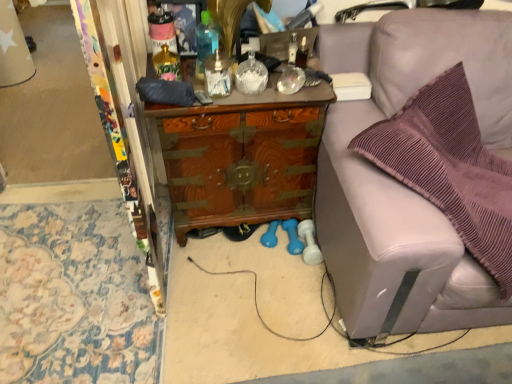
Question: Which direction should I rotate to face clear glass jar at center, which appears as the 1th bottle when viewed from the right, — up or down?

Choices:
 (A) up
 (B) down

Answer: (A)

Question: Which direction should I rotate to face translucent blue bottle at center, the third bottle when ordered from left to right, — up or down?

Choices:
 (A) down
 (B) up

Answer: (B)

Question: From the image's perspective, is purple fabric chair at right under translucent glass vase at center, placed as the 4th bottle when sorted from right to left?

Choices:
 (A) no
 (B) yes

Answer: (B)

Question: From the image's perspective, is purple fabric chair at right on top of translucent glass vase at center, the second bottle from the left?

Choices:
 (A) yes
 (B) no

Answer: (B)

Question: Would you say purple fabric chair at right is outside translucent glass vase at center, the second bottle from the left?

Choices:
 (A) no
 (B) yes

Answer: (B)

Question: Can you confirm if purple fabric chair at right is taller than translucent glass vase at center, placed as the 4th bottle when sorted from right to left?

Choices:
 (A) yes
 (B) no

Answer: (A)

Question: Is purple fabric chair at right next to translucent glass vase at center, placed as the 4th bottle when sorted from right to left?

Choices:
 (A) no
 (B) yes

Answer: (A)

Question: Considering the relative sizes of purple fabric chair at right and translucent glass vase at center, the second bottle from the left, in the image provided, is purple fabric chair at right wider than translucent glass vase at center, the second bottle from the left,?

Choices:
 (A) yes
 (B) no

Answer: (A)

Question: Is wooden chest at center far away from clear glass jar at center, which appears as the 1th bottle when viewed from the right?

Choices:
 (A) no
 (B) yes

Answer: (A)

Question: From a real-world perspective, is wooden chest at center located higher than clear glass jar at center, which appears as the 1th bottle when viewed from the right?

Choices:
 (A) no
 (B) yes

Answer: (A)

Question: Does wooden chest at center have a greater height compared to clear glass jar at center, which appears as the 1th bottle when viewed from the right?

Choices:
 (A) no
 (B) yes

Answer: (B)

Question: Does wooden chest at center appear on the left side of clear glass jar at center, which is the 5th bottle in left-to-right order?

Choices:
 (A) no
 (B) yes

Answer: (B)

Question: Considering the relative sizes of wooden chest at center and clear glass jar at center, which appears as the 1th bottle when viewed from the right, in the image provided, is wooden chest at center thinner than clear glass jar at center, which appears as the 1th bottle when viewed from the right,?

Choices:
 (A) yes
 (B) no

Answer: (B)

Question: Is the depth of wooden chest at center greater than that of clear glass jar at center, which appears as the 1th bottle when viewed from the right?

Choices:
 (A) yes
 (B) no

Answer: (A)

Question: Does matte pink plastic bottle at upper center, marked as the fifth bottle in a right-to-left arrangement, have a larger size compared to wooden chest at center?

Choices:
 (A) no
 (B) yes

Answer: (A)